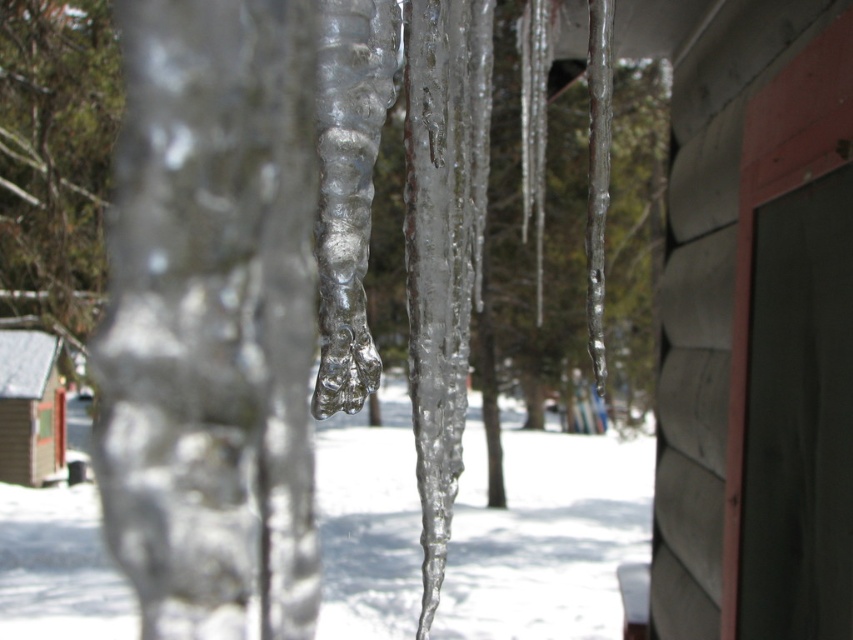
You are an architect designing a winter village and want to ensure the icicles on the wooden cabin at lower left are proportionate to the transparent ice icicles at center. Given that the icicles at center are narrower, should the icicles on the cabin be wider or narrower?

The transparent ice icicles at center are narrower than the wooden cabin at lower left, so the icicles on the cabin should be wider to maintain proportionate size relative to the cabin structure.

You are standing in front of a wooden structure with icicles hanging from its edge. You want to take a photo of the transparent ice icicles at center. Where exactly should you aim your camera to capture them?

You should aim your camera at point (544, 534) to capture the transparent ice icicles at center.